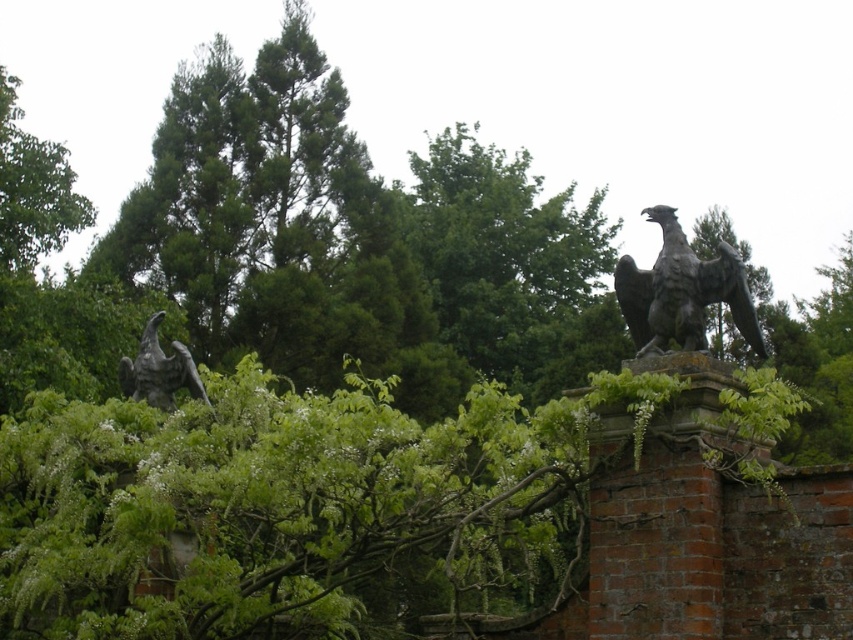
Can you confirm if polished bronze eagle at upper right is positioned above polished bronze eagle at left?

Yes.

Is point (641, 317) positioned in front of point (141, 394)?

Yes, it is.

You are a GUI agent. You are given a task and a screenshot of the screen. Output one action in this format:
    pyautogui.click(x=<x>, y=<y>)
    Task: Click on the polished bronze eagle at upper right
    
    Given the screenshot: What is the action you would take?
    pyautogui.click(x=682, y=291)